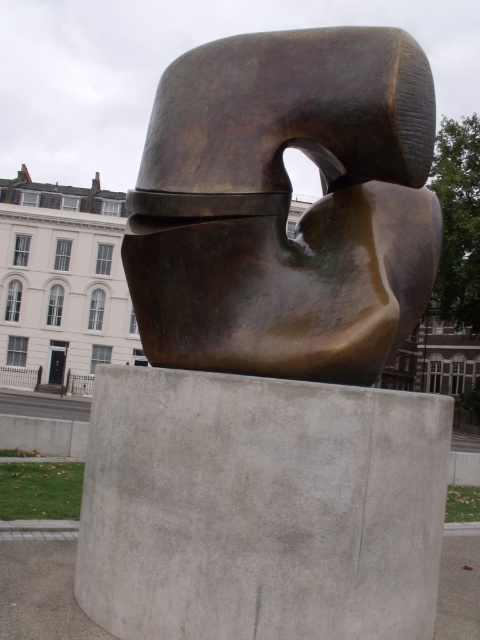
Between point (276, 248) and point (124, 540), which one is positioned behind?

Positioned behind is point (276, 248).

Can you confirm if bronze sculpture at center is bigger than gray concrete at center?

Incorrect, bronze sculpture at center is not larger than gray concrete at center.

Is point (280, 154) in front of point (248, 560)?

No, (280, 154) is behind (248, 560).

You are a GUI agent. You are given a task and a screenshot of the screen. Output one action in this format:
    pyautogui.click(x=<x>, y=<y>)
    Task: Click on the bronze sculpture at center
    
    Given the screenshot: What is the action you would take?
    pyautogui.click(x=286, y=205)